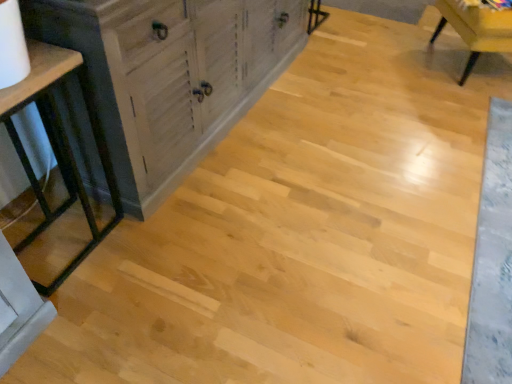
Question: In terms of height, does wooden chair at upper right look taller or shorter compared to distressed wood cabinet at left?

Choices:
 (A) short
 (B) tall

Answer: (A)

Question: From a real-world perspective, is wooden chair at upper right positioned above or below distressed wood cabinet at left?

Choices:
 (A) below
 (B) above

Answer: (A)

Question: Based on their relative distances, which object is farther from the wooden chair at upper right?

Choices:
 (A) matte black table at left
 (B) distressed wood cabinet at left

Answer: (A)

Question: Which object is positioned closest to the wooden chair at upper right?

Choices:
 (A) matte black table at left
 (B) distressed wood cabinet at left

Answer: (B)